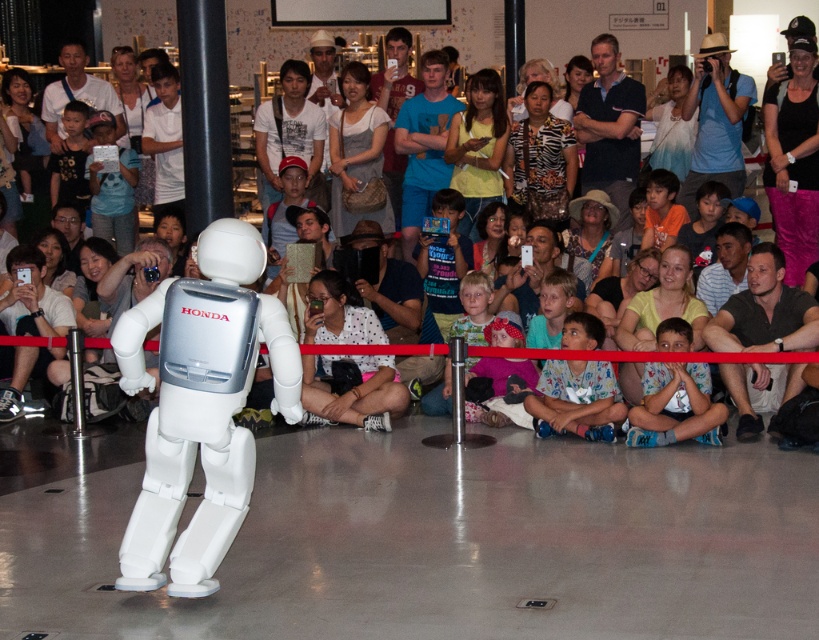
Question: Considering the relative positions of printed cotton shirt at lower center and white cotton shirt at upper center in the image provided, where is printed cotton shirt at lower center located with respect to white cotton shirt at upper center?

Choices:
 (A) below
 (B) above

Answer: (A)

Question: Can you confirm if pink fabric at upper right is smaller than matte blue shirt at upper right?

Choices:
 (A) no
 (B) yes

Answer: (B)

Question: Which object is the closest to the light blue fabric shirt at lower right?

Choices:
 (A) white matte camera at lower left
 (B) blue cotton shirt at upper center
 (C) white fabric crowd at center
 (D) white fabric hat at center

Answer: (D)

Question: Is light brown fabric dress at center below ombre blue shirt at center?

Choices:
 (A) yes
 (B) no

Answer: (A)

Question: Considering the real-world distances, which object is farthest from the pink fabric at upper right?

Choices:
 (A) matte blue shirt at upper right
 (B) yellow matte shirt at center

Answer: (B)

Question: Estimate the real-world distances between objects in this image. Which object is closer to the blue cotton shirt at center?

Choices:
 (A) white fabric crowd at center
 (B) light blue fabric shirt at lower right
 (C) white t-shirt at center

Answer: (A)